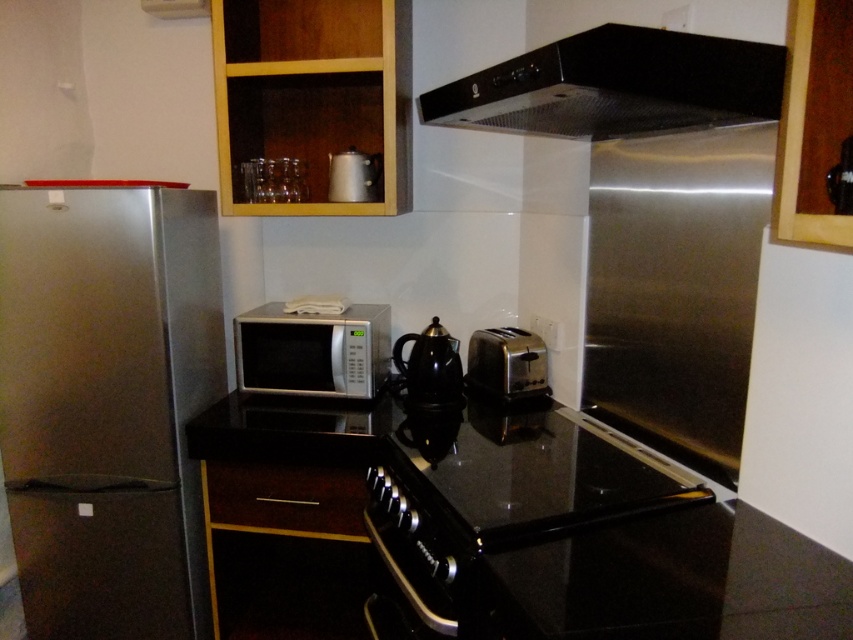
Question: Is black metallic exhaust hood at upper center above satin silver toaster at center?

Choices:
 (A) no
 (B) yes

Answer: (B)

Question: Which of the following is the farthest from the observer?

Choices:
 (A) (410, 406)
 (B) (70, 224)
 (C) (350, 376)

Answer: (A)

Question: Can you confirm if silver/glossy microwave at center is smaller than satin silver toaster at center?

Choices:
 (A) yes
 (B) no

Answer: (B)

Question: Which of the following is the closest to the observer?

Choices:
 (A) 641,515
 (B) 444,353

Answer: (A)

Question: Which object is the farthest from the stainless steel refrigerator at left?

Choices:
 (A) satin silver toaster at center
 (B) black glossy kettle at center

Answer: (A)

Question: Can you confirm if black metallic exhaust hood at upper center is positioned to the left of silver/glossy microwave at center?

Choices:
 (A) no
 (B) yes

Answer: (A)